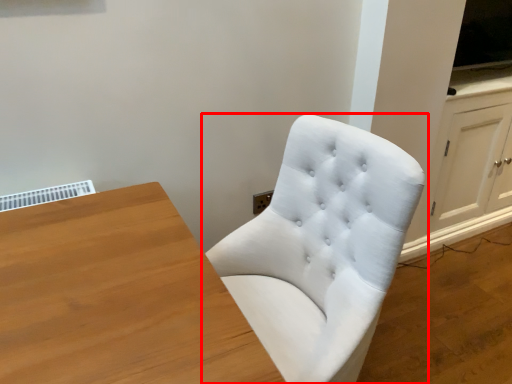
Question: Considering the relative positions of chair (annotated by the red box) and dresser in the image provided, where is chair (annotated by the red box) located with respect to the staircase?

Choices:
 (A) left
 (B) right

Answer: (A)